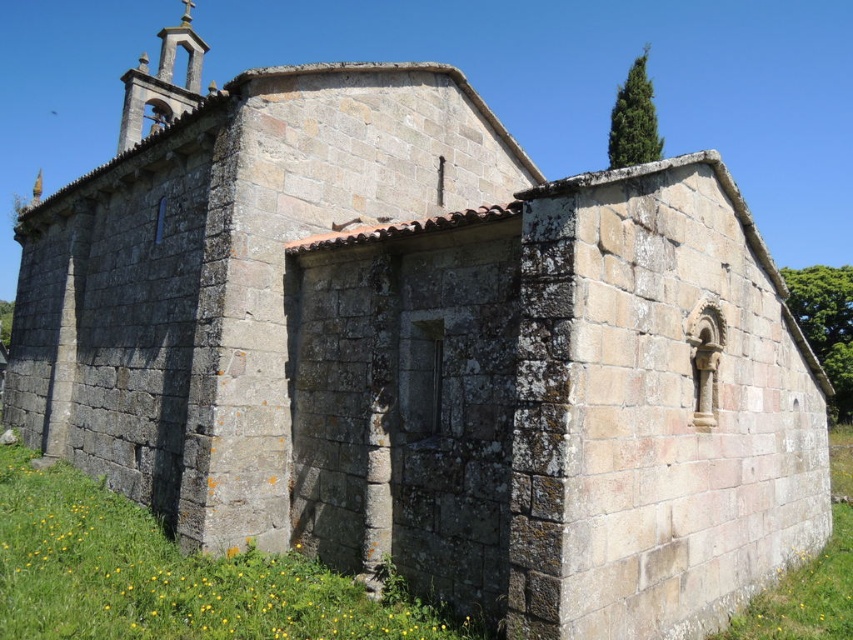
Does point (108, 580) come in front of point (848, 428)?

Yes, it is.

Who is shorter, green mossy stone wall at lower center or green grass at lower right?

Standing shorter between the two is green mossy stone wall at lower center.

Where is `green mossy stone wall at lower center`? The image size is (853, 640). green mossy stone wall at lower center is located at coordinates (164, 576).